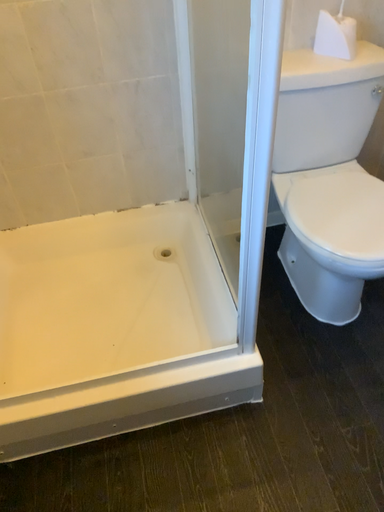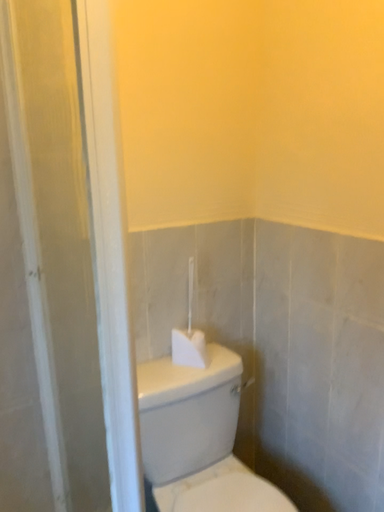
Question: Which way did the camera rotate in the video?

Choices:
 (A) rotated downward
 (B) rotated upward

Answer: (B)